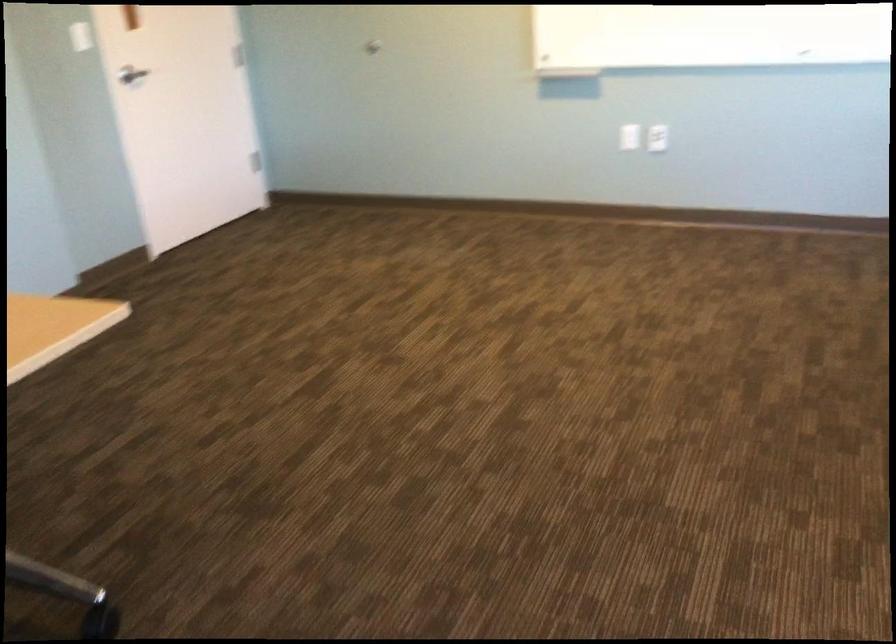
The height and width of the screenshot is (644, 896). I want to click on white light switch, so point(657,138).